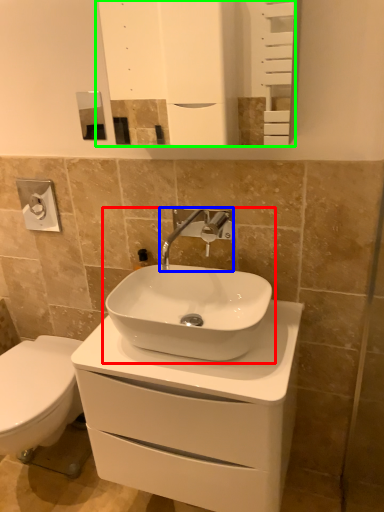
Question: Which object is positioned closest to sink (highlighted by a red box)? Select from tap (highlighted by a blue box) and mirror (highlighted by a green box).

Choices:
 (A) tap
 (B) mirror

Answer: (A)